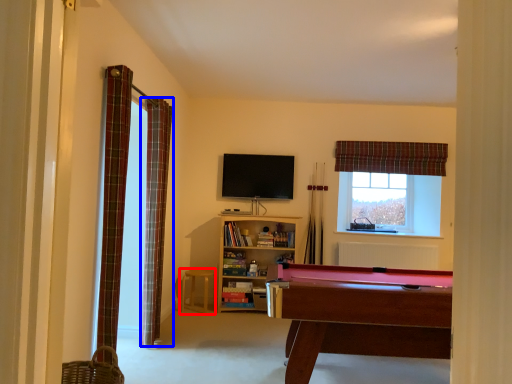
Question: Which object appears closest to the camera in this image, stool (highlighted by a red box) or curtain (highlighted by a blue box)?

Choices:
 (A) stool
 (B) curtain

Answer: (B)